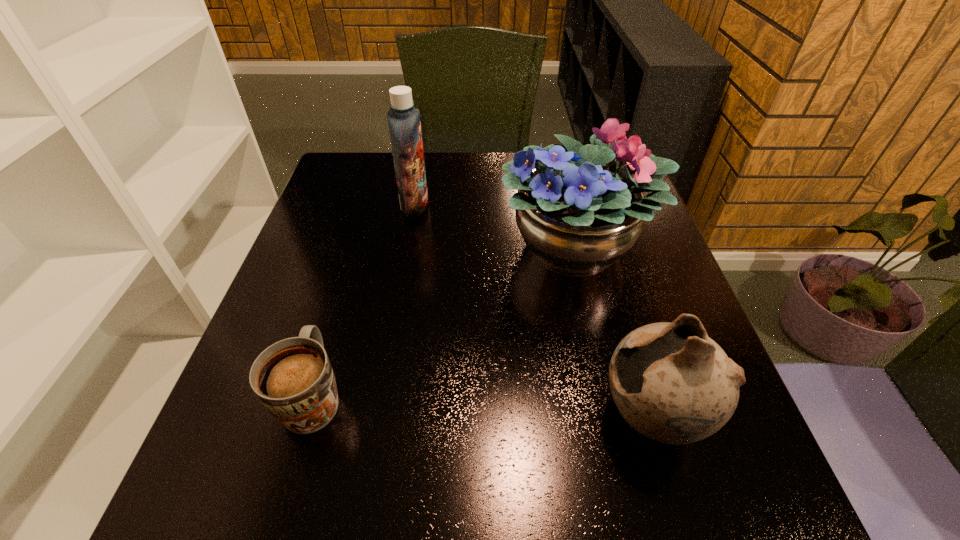
Image resolution: width=960 pixels, height=540 pixels. In order to click on the second object from left to right in this screenshot , I will do `click(404, 124)`.

The image size is (960, 540). I want to click on bouquet, so click(577, 216).

This screenshot has height=540, width=960. In order to click on the third tallest object in this screenshot , I will do `click(672, 383)`.

You are a GUI agent. You are given a task and a screenshot of the screen. Output one action in this format:
    pyautogui.click(x=<x>, y=<y>)
    Task: Click on the mug
    Image resolution: width=960 pixels, height=540 pixels.
    Given the screenshot: What is the action you would take?
    pyautogui.click(x=293, y=378)

Locate an element on the screen. The height and width of the screenshot is (540, 960). the shortest object is located at coordinates (293, 378).

What are the coordinates of `vacant space situated 0.110m on the front label of the shampoo` in the screenshot? It's located at (470, 205).

Image resolution: width=960 pixels, height=540 pixels. Find the location of `vacant space situated 0.390m on the left of the bouquet`. vacant space situated 0.390m on the left of the bouquet is located at coordinates pos(334,246).

Image resolution: width=960 pixels, height=540 pixels. In order to click on free location located 0.250m from the spout of the pottery in this screenshot , I will do `click(449, 415)`.

Where is `vacant space situated from the spout of the pottery`? vacant space situated from the spout of the pottery is located at coordinates (509, 415).

This screenshot has height=540, width=960. Find the location of `vacant space situated from the spout of the pottery`. vacant space situated from the spout of the pottery is located at coordinates (496, 415).